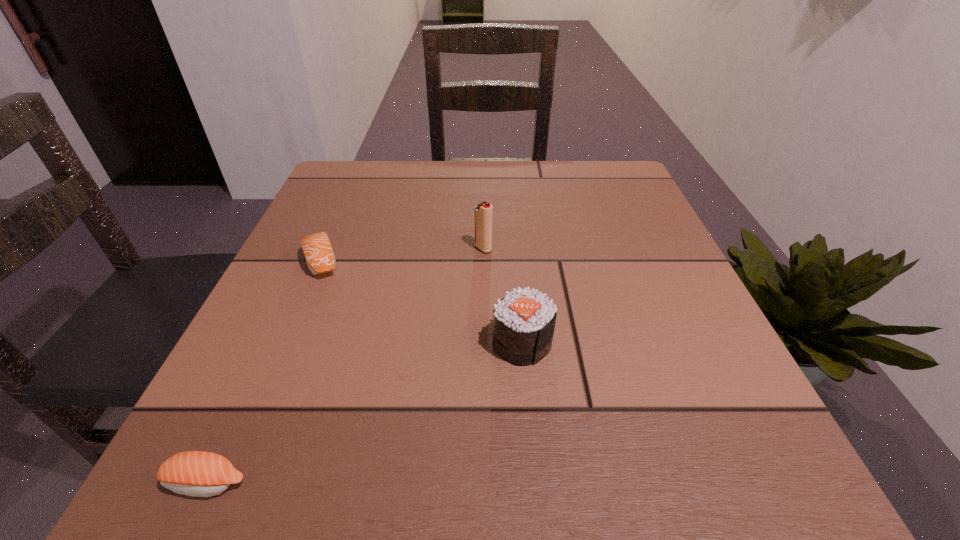
In order to click on vacant point located between the farthest sushi and the second nearest sushi in this screenshot , I will do `click(422, 302)`.

Identify the location of free spot between the third shortest object and the farthest sushi. The image size is (960, 540). (422, 302).

Find the location of a particular element. vacant space that's between the third farthest object and the farthest sushi is located at coordinates (422, 302).

Where is `free spot between the farthest sushi and the second tallest object`? Image resolution: width=960 pixels, height=540 pixels. free spot between the farthest sushi and the second tallest object is located at coordinates (x=422, y=302).

Locate an element on the screen. free space between the farthest sushi and the tallest object is located at coordinates (402, 255).

Find the location of a particular element. free space that is in between the third farthest object and the farthest sushi is located at coordinates (422, 302).

This screenshot has width=960, height=540. I want to click on vacant area that lies between the farthest sushi and the igniter, so click(402, 255).

Identify the location of the closest object to the farthest sushi. The image size is (960, 540). (483, 212).

Where is `object that is the second closest one to the third farthest object`? This screenshot has width=960, height=540. object that is the second closest one to the third farthest object is located at coordinates (317, 248).

Find the location of `sushi identified as the third closest to the igniter`. sushi identified as the third closest to the igniter is located at coordinates (194, 473).